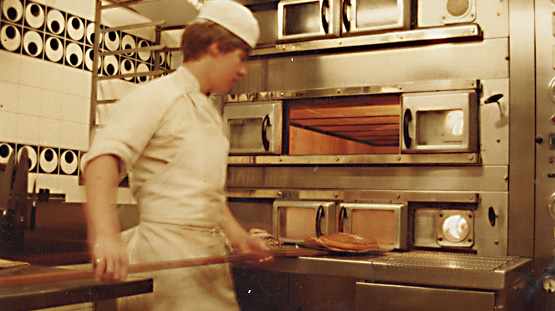
You are a GUI agent. You are given a task and a screenshot of the screen. Output one action in this format:
    pyautogui.click(x=<x>, y=<y>)
    Task: Click on the black handles
    The image size is (555, 311).
    Given the screenshot: What is the action you would take?
    pyautogui.click(x=321, y=14), pyautogui.click(x=263, y=133), pyautogui.click(x=405, y=130), pyautogui.click(x=342, y=218), pyautogui.click(x=319, y=220), pyautogui.click(x=346, y=21)